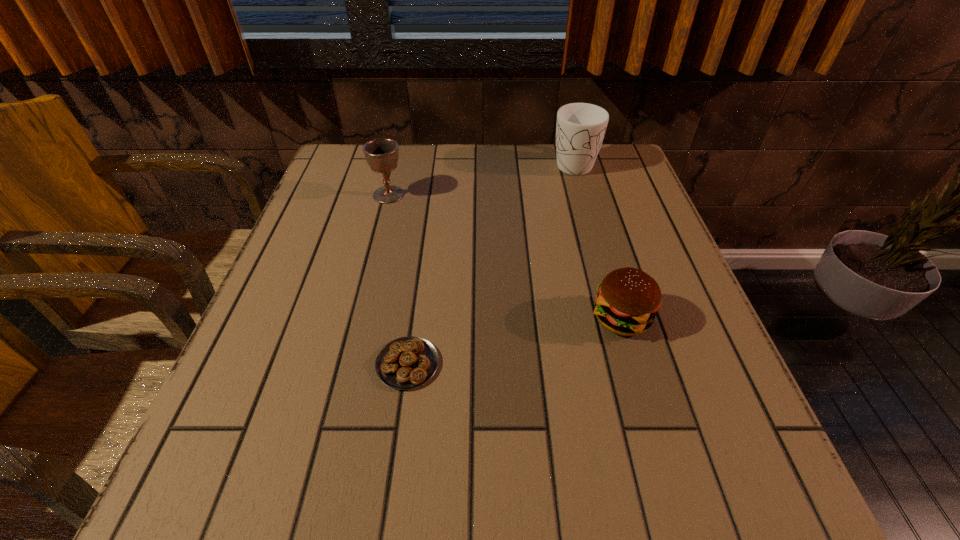
Find the location of `vacant area that lies between the shortest object and the mug`. vacant area that lies between the shortest object and the mug is located at coordinates (491, 263).

The width and height of the screenshot is (960, 540). What are the coordinates of `free area in between the third tallest object and the third nearest object` in the screenshot? It's located at (505, 256).

The height and width of the screenshot is (540, 960). Identify the location of blank region between the farthest object and the hamburger. (597, 240).

Image resolution: width=960 pixels, height=540 pixels. What are the coordinates of `object that ranks as the second closest to the pastry` in the screenshot? It's located at (381, 154).

Identify which object is the nearest to the pastry. Please provide its 2D coordinates. Your answer should be formatted as a tuple, i.e. [(x, y)], where the tuple contains the x and y coordinates of a point satisfying the conditions above.

[(628, 299)]

Find the location of a particular element. This screenshot has height=540, width=960. vacant space that satisfies the following two spatial constraints: 1. on the side of the hamburger with the handle; 2. on the right side of the farthest object is located at coordinates (617, 318).

At what (x,y) coordinates should I click in order to perform the action: click on vacant area in the image that satisfies the following two spatial constraints: 1. on the side of the hamburger with the handle; 2. on the left side of the farthest object. Please return your answer as a coordinate pair (x, y). Looking at the image, I should click on (617, 318).

Find the location of a particular element. Image resolution: width=960 pixels, height=540 pixels. free space that satisfies the following two spatial constraints: 1. on the side of the farthest object with the handle; 2. on the left side of the hamburger is located at coordinates (617, 318).

You are a GUI agent. You are given a task and a screenshot of the screen. Output one action in this format:
    pyautogui.click(x=<x>, y=<y>)
    Task: Click on the vacant space that satisfies the following two spatial constraints: 1. on the side of the farthest object with the handle; 2. on the right side of the hamburger
    
    Given the screenshot: What is the action you would take?
    pyautogui.click(x=617, y=318)